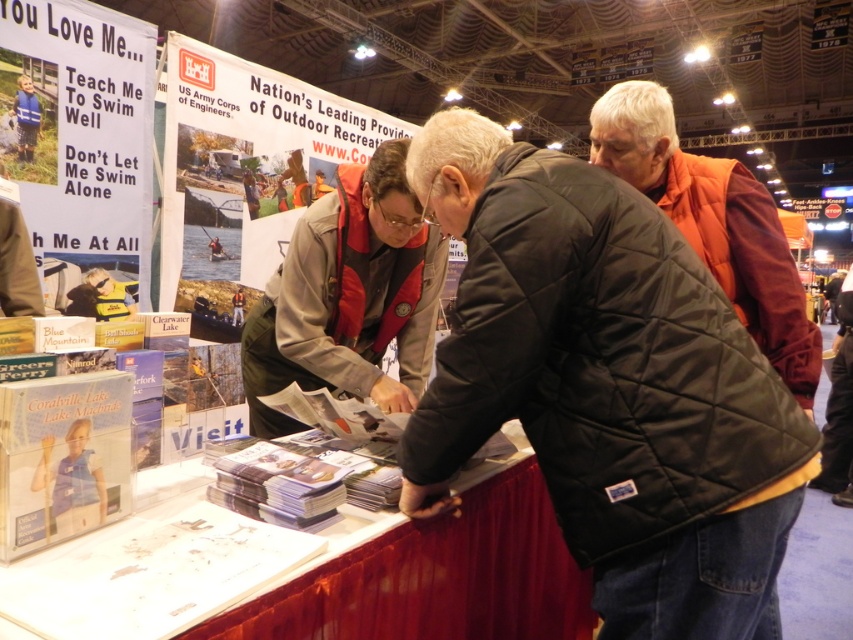
In the scene shown: Is black quilted vest at center further to the viewer compared to khaki uniform at center?

That is False.

Does point (489, 432) lie in front of point (270, 336)?

Yes.

Who is more forward, (x=576, y=328) or (x=281, y=298)?

Point (x=576, y=328) is more forward.

I want to click on black quilted vest at center, so click(607, 387).

Does khaki uniform at center appear on the right side of orange quilted vest at center?

Incorrect, khaki uniform at center is not on the right side of orange quilted vest at center.

Where is `khaki uniform at center`? This screenshot has width=853, height=640. khaki uniform at center is located at coordinates (347, 296).

Where is `khaki uniform at center`? This screenshot has width=853, height=640. khaki uniform at center is located at coordinates (347, 296).

Does point (683, 289) come in front of point (697, 156)?

Yes.

Is point (682, 605) more distant than point (751, 204)?

No, it is in front of (751, 204).

Find the location of `black quilted vest at center`. black quilted vest at center is located at coordinates (607, 387).